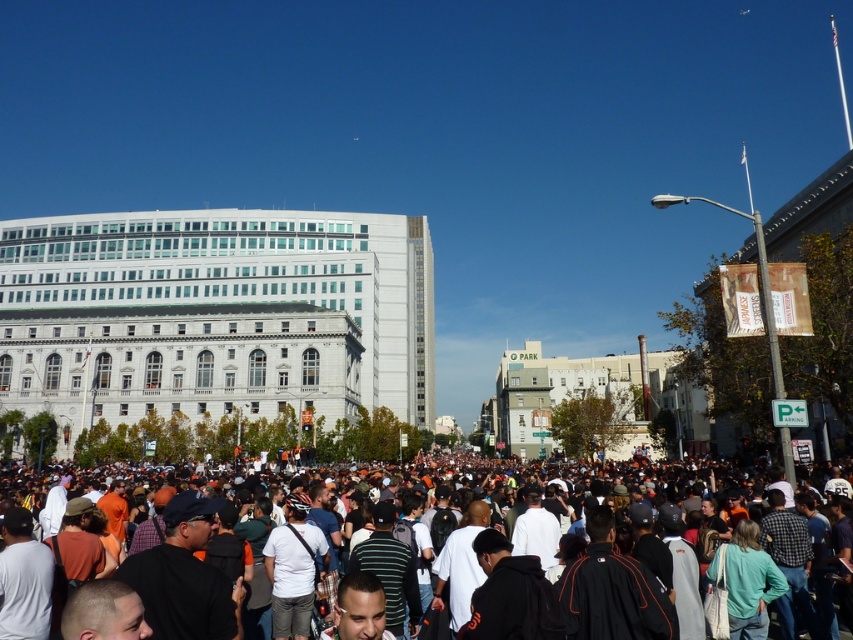
Can you confirm if white marble building at center is positioned to the left of orange fabric crowd at center?

Correct, you'll find white marble building at center to the left of orange fabric crowd at center.

This screenshot has height=640, width=853. In order to click on white marble building at center in this screenshot , I will do `click(216, 314)`.

Image resolution: width=853 pixels, height=640 pixels. Find the location of `white marble building at center`. white marble building at center is located at coordinates (216, 314).